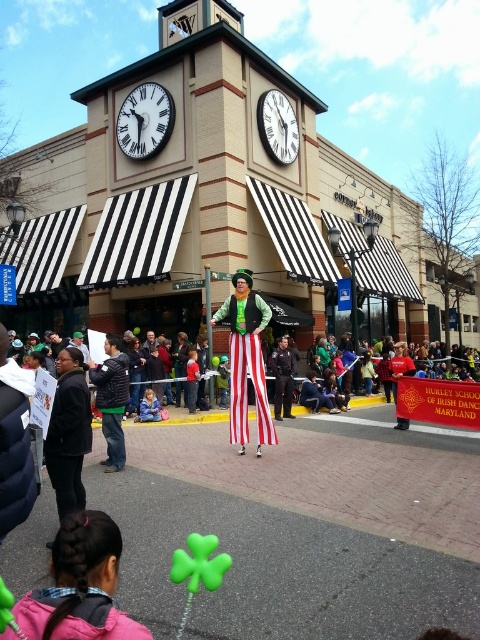
You are standing at the point marked by coordinates point (218, 205) in the street scene. Which object are you directly in front of?

You are directly in front of the beige brick building at center, as the point (218, 205) represents its location.

You are a photographer positioned on the street. You want to take a photo of the smooth black uniform at center without the beige brick building at center blocking it. How should you adjust your position?

To capture the smooth black uniform at center without the beige brick building at center blocking it, move to a position where the smooth black uniform at center is no longer aligned behind the beige brick building at center. Since the smooth black uniform at center is behind the beige brick building at center, shifting your angle or moving to the side could allow you to frame the shot so the uniform is visible without obstruction.